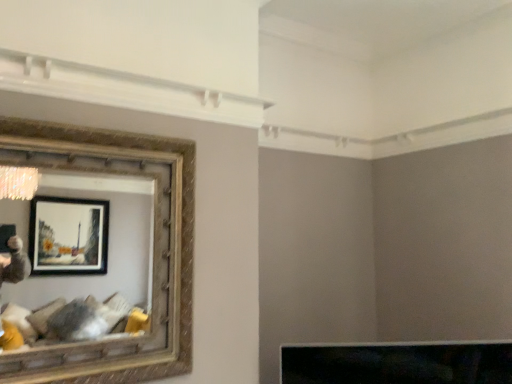
Question: In terms of size, does black glossy tv at lower center appear bigger or smaller than gold textured picture frame at left?

Choices:
 (A) small
 (B) big

Answer: (A)

Question: Is black glossy tv at lower center inside or outside of gold textured picture frame at left?

Choices:
 (A) inside
 (B) outside

Answer: (B)

Question: Is black glossy tv at lower center in front of or behind gold textured picture frame at left in the image?

Choices:
 (A) front
 (B) behind

Answer: (B)

Question: Is gold textured picture frame at left bigger or smaller than black glossy tv at lower center?

Choices:
 (A) small
 (B) big

Answer: (B)

Question: Looking at their shapes, would you say gold textured picture frame at left is wider or thinner than black glossy tv at lower center?

Choices:
 (A) thin
 (B) wide

Answer: (A)

Question: Relative to black glossy tv at lower center, is gold textured picture frame at left in front or behind?

Choices:
 (A) behind
 (B) front

Answer: (B)

Question: From a real-world perspective, is gold textured picture frame at left physically located above or below black glossy tv at lower center?

Choices:
 (A) below
 (B) above

Answer: (B)